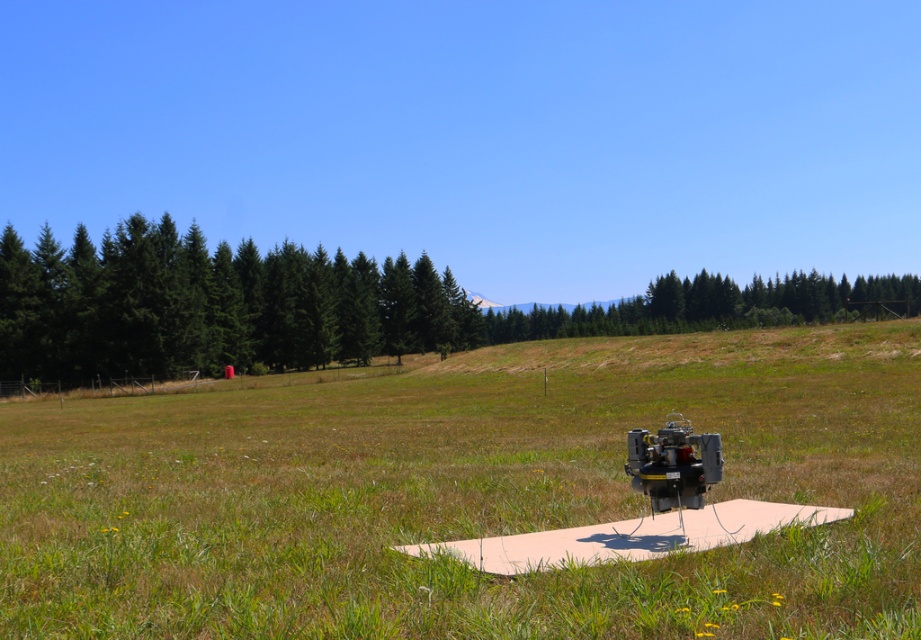
Question: Is green matte trees at left wider than green textured tree at center?

Choices:
 (A) yes
 (B) no

Answer: (B)

Question: Which object appears closest to the camera in this image?

Choices:
 (A) green grass at center
 (B) green textured tree at center
 (C) green matte trees at left

Answer: (A)

Question: Which point is farther to the camera?

Choices:
 (A) (628, 324)
 (B) (232, 362)
 (C) (381, 412)

Answer: (A)

Question: Is green matte trees at left further to camera compared to green textured tree at center?

Choices:
 (A) yes
 (B) no

Answer: (B)

Question: Which point is farther to the camera?

Choices:
 (A) green matte trees at left
 (B) green textured tree at center

Answer: (B)

Question: Is green grass at center smaller than green textured tree at center?

Choices:
 (A) yes
 (B) no

Answer: (A)